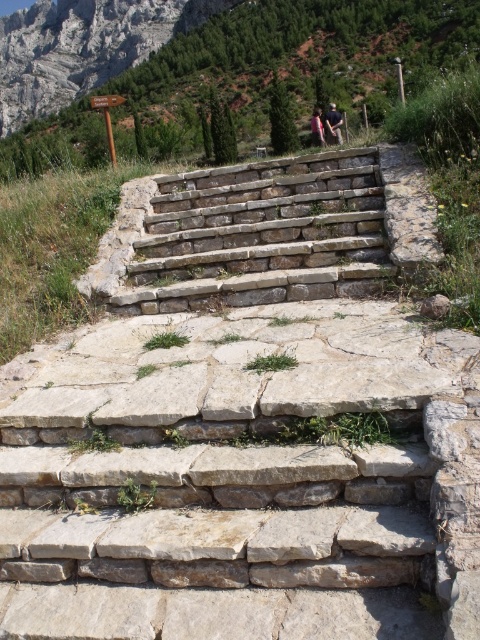
Does dark blue shirt at center lie behind pink fabric at center?

No, it is in front of pink fabric at center.

Does dark blue shirt at center have a lesser height compared to pink fabric at center?

Yes.

Between point (339, 141) and point (312, 129), which one is positioned in front?

Positioned in front is point (312, 129).

The height and width of the screenshot is (640, 480). What are the coordinates of `dark blue shirt at center` in the screenshot? It's located at (333, 124).

Is natural stone stairs at center to the right of dark blue shirt at center from the viewer's perspective?

No, natural stone stairs at center is not to the right of dark blue shirt at center.

Is point (320, 166) positioned before point (332, 120)?

Yes.

Who is more distant from viewer, (259,248) or (328,125)?

Point (328,125)

Locate an element on the screen. The image size is (480, 640). natural stone stairs at center is located at coordinates (261, 236).

Does natural stone stairs at center come in front of pink fabric at center?

Yes, it is.

Is point (370, 156) less distant than point (314, 125)?

Yes, point (370, 156) is in front of point (314, 125).

In order to click on natural stone stairs at center in this screenshot , I will do `click(261, 236)`.